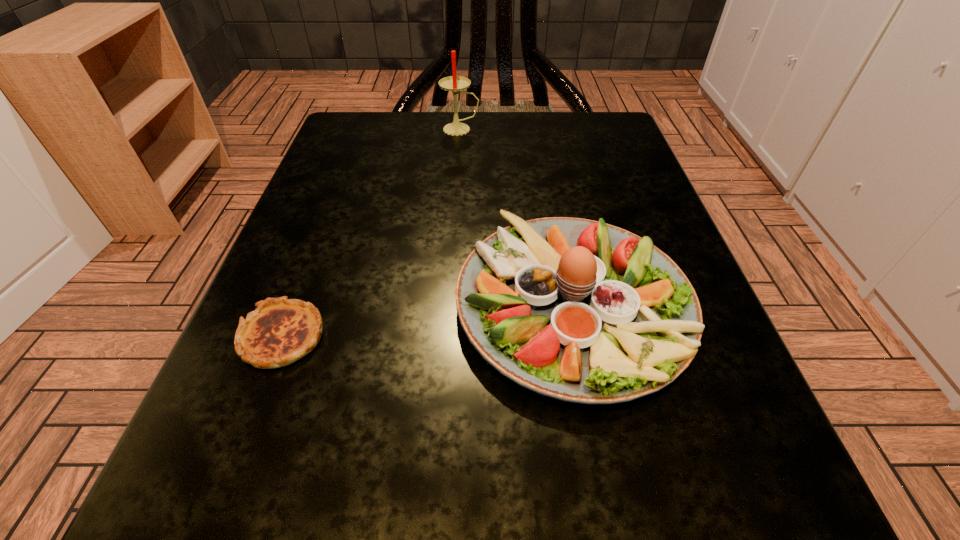
Identify the location of free space that is in between the shortest object and the second tallest object. The width and height of the screenshot is (960, 540). (427, 321).

Identify the location of vacant area that lies between the shortest object and the candle. (372, 233).

The image size is (960, 540). Identify the location of empty space between the quiche and the farthest object. (372, 233).

Where is `empty location between the farthest object and the leftmost object`? The width and height of the screenshot is (960, 540). empty location between the farthest object and the leftmost object is located at coordinates (372, 233).

This screenshot has width=960, height=540. I want to click on the second closest object relative to the candle, so click(x=280, y=331).

Where is `object that is the second closest to the quiche`? object that is the second closest to the quiche is located at coordinates (453, 83).

The height and width of the screenshot is (540, 960). In order to click on free spot that satisfies the following two spatial constraints: 1. on the back side of the quiche; 2. on the left side of the second shortest object in this screenshot , I will do [x=294, y=305].

This screenshot has width=960, height=540. I want to click on vacant point that satisfies the following two spatial constraints: 1. on the back side of the shortest object; 2. on the right side of the second tallest object, so click(294, 305).

At what (x,y) coordinates should I click in order to perform the action: click on blank area in the image that satisfies the following two spatial constraints: 1. on the front side of the salad plate; 2. on the left side of the candle. Please return your answer as a coordinate pair (x, y). This screenshot has width=960, height=540. Looking at the image, I should click on (449, 305).